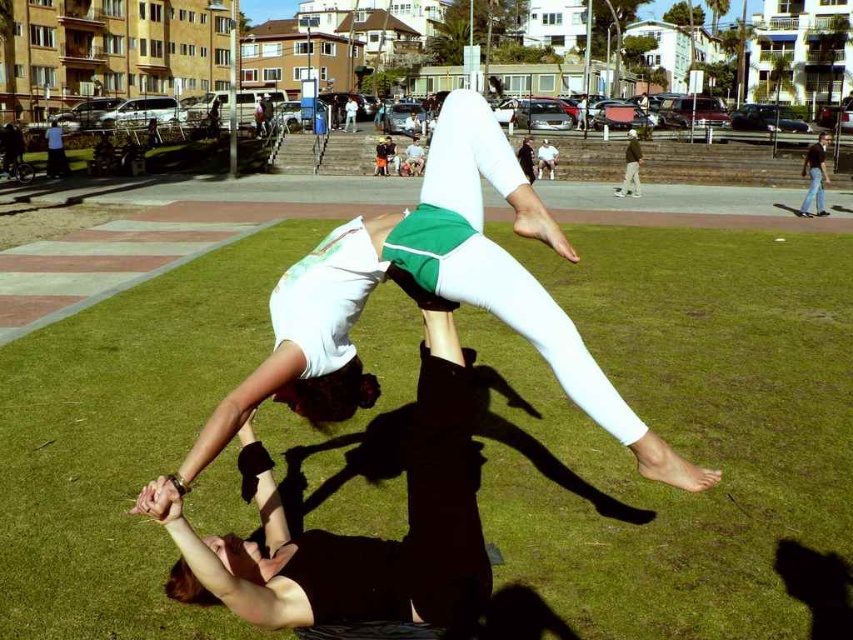
Which is behind, point (352, 401) or point (635, 138)?

The point (635, 138) is behind.

Does white matte leggings at center have a greater width compared to brown cotton pants at center?

In fact, white matte leggings at center might be narrower than brown cotton pants at center.

Is point (326, 257) positioned after point (625, 188)?

No, (326, 257) is closer to viewer.

Where is `white matte leggings at center`? The height and width of the screenshot is (640, 853). white matte leggings at center is located at coordinates (428, 298).

Can you confirm if black jeans at lower right is bigger than brown cotton pants at center?

Yes.

What do you see at coordinates (814, 177) in the screenshot?
I see `black jeans at lower right` at bounding box center [814, 177].

Measure the distance between black jeans at lower right and camera.

black jeans at lower right and camera are 19.46 meters apart from each other.

Locate an element on the screen. Image resolution: width=853 pixels, height=640 pixels. black jeans at lower right is located at coordinates (814, 177).

How distant is white matte leggings at center from light brown wooden bench at center?

white matte leggings at center and light brown wooden bench at center are 85.06 feet apart.

Describe the element at coordinates (428, 298) in the screenshot. The height and width of the screenshot is (640, 853). I see `white matte leggings at center` at that location.

Is point (422, 289) positioned after point (544, 161)?

No, it is not.

Where is `white matte leggings at center`? The height and width of the screenshot is (640, 853). white matte leggings at center is located at coordinates (428, 298).